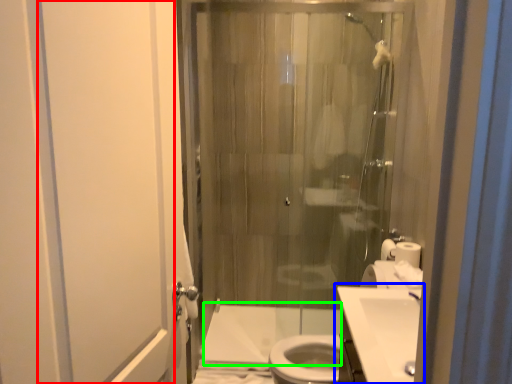
Question: Considering the real-world distances, which object is closest to screen door (highlighted by a red box)? sink (highlighted by a blue box) or bath (highlighted by a green box).

Choices:
 (A) sink
 (B) bath

Answer: (A)